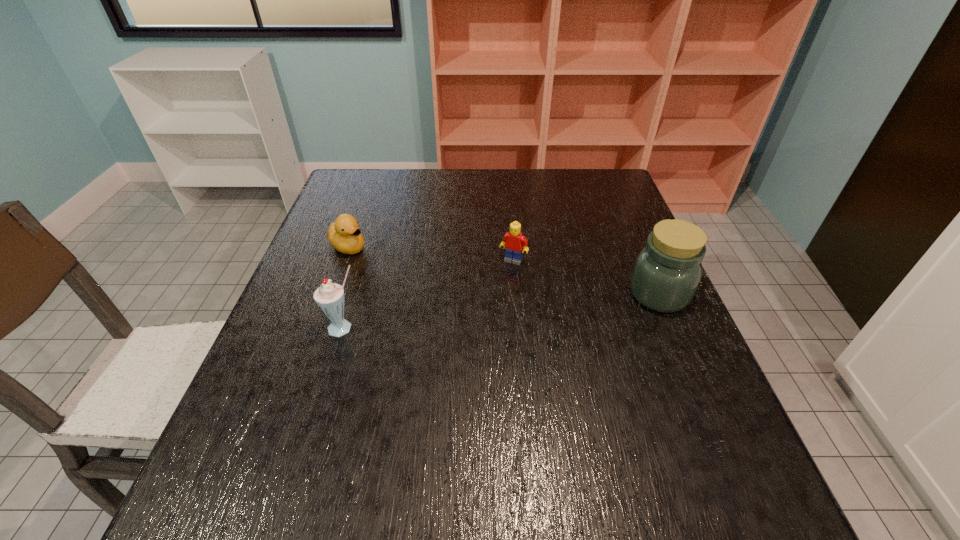
This screenshot has height=540, width=960. What are the coordinates of `vacant region at the far left corner of the desktop` in the screenshot? It's located at (338, 201).

In the image, there is a desktop. What are the coordinates of `blank space at the far right corner` in the screenshot? It's located at (577, 201).

At what (x,y) coordinates should I click in order to perform the action: click on free space between the duckling and the milkshake. Please return your answer as a coordinate pair (x, y). The height and width of the screenshot is (540, 960). Looking at the image, I should click on (347, 287).

Find the location of a particular element. empty space between the Lego and the jar is located at coordinates 586,277.

I want to click on vacant space in between the nearest object and the duckling, so click(x=347, y=287).

The height and width of the screenshot is (540, 960). What are the coordinates of `vacant area that lies between the duckling and the Lego` in the screenshot? It's located at (431, 253).

What are the coordinates of `empty location between the third object from left to right and the second nearest object` in the screenshot? It's located at (586, 277).

This screenshot has width=960, height=540. I want to click on vacant area between the jar and the second object from right to left, so click(x=586, y=277).

What are the coordinates of `free point between the Lego and the milkshake` in the screenshot? It's located at (429, 294).

In order to click on free space between the duckling and the milkshake in this screenshot , I will do (x=347, y=287).